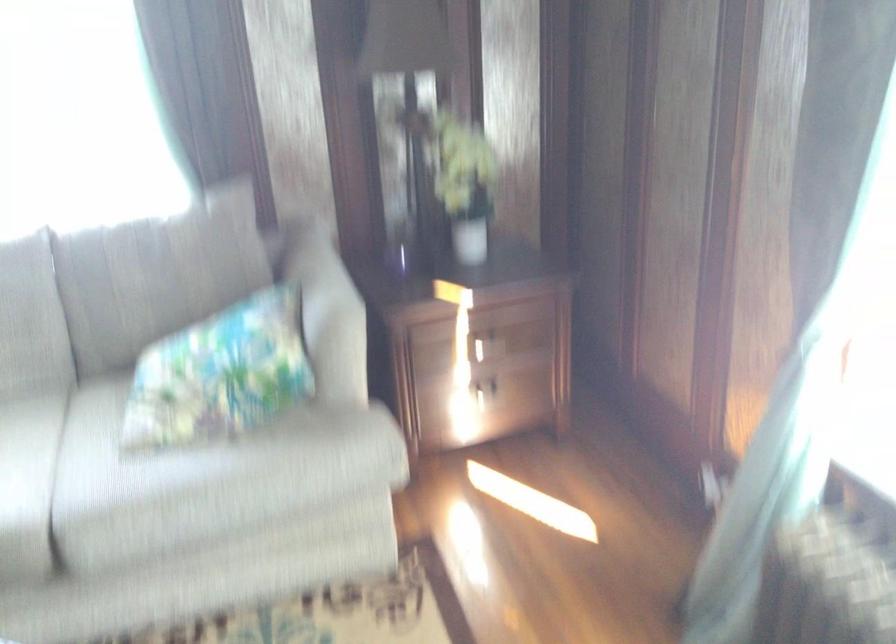
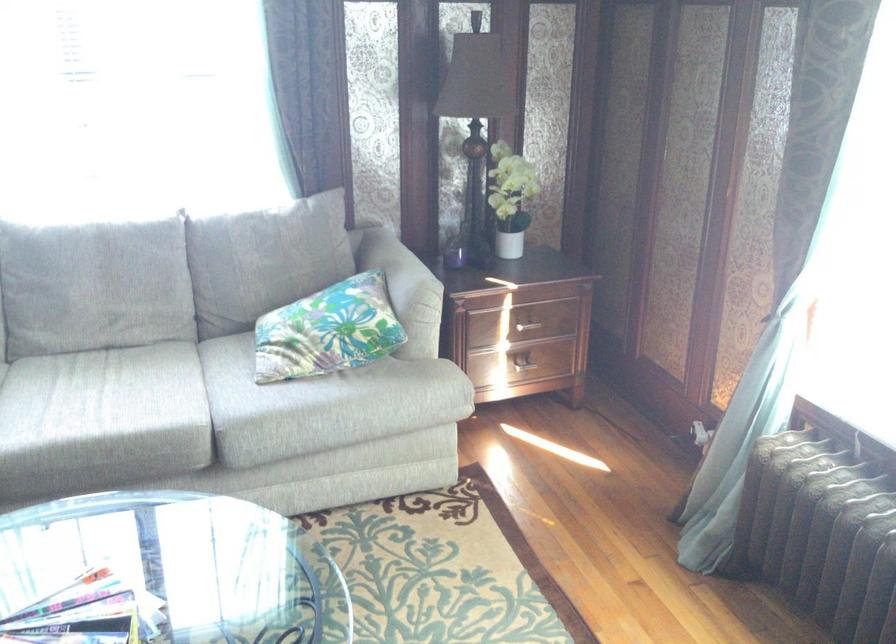
Find the pixel in the second image that matches the point at 466,191 in the first image.

(511, 199)